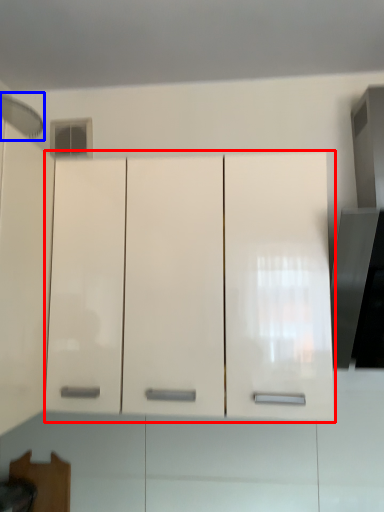
Question: Which of the following is the farthest to the observer, cabinetry (highlighted by a red box) or exhaust hood (highlighted by a blue box)?

Choices:
 (A) cabinetry
 (B) exhaust hood

Answer: (A)